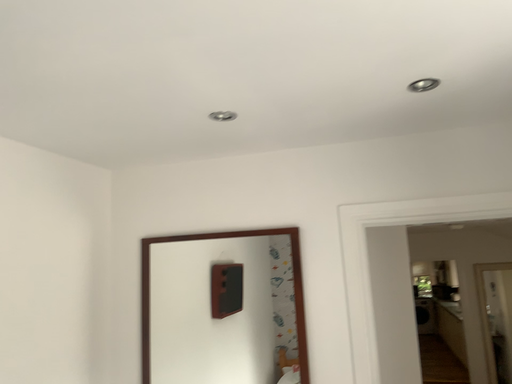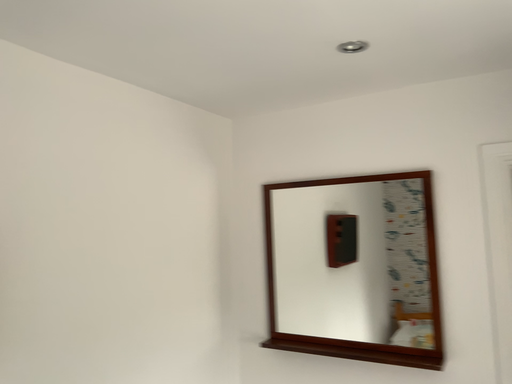
Question: Which way did the camera rotate in the video?

Choices:
 (A) rotated left
 (B) rotated right

Answer: (A)